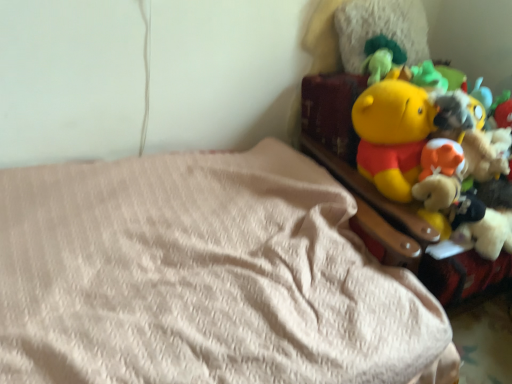
Question: From a real-world perspective, is yellow plush toy at upper right beneath beige fabric bed at lower left?

Choices:
 (A) yes
 (B) no

Answer: (B)

Question: Is there a large distance between yellow plush toy at upper right and beige fabric bed at lower left?

Choices:
 (A) yes
 (B) no

Answer: (B)

Question: Considering the relative sizes of yellow plush toy at upper right and beige fabric bed at lower left in the image provided, is yellow plush toy at upper right thinner than beige fabric bed at lower left?

Choices:
 (A) no
 (B) yes

Answer: (B)

Question: From a real-world perspective, is yellow plush toy at upper right located higher than beige fabric bed at lower left?

Choices:
 (A) no
 (B) yes

Answer: (B)

Question: Would you say yellow plush toy at upper right contains beige fabric bed at lower left?

Choices:
 (A) yes
 (B) no

Answer: (B)

Question: Is yellow plush toy at upper right positioned behind beige fabric bed at lower left?

Choices:
 (A) yes
 (B) no

Answer: (A)

Question: From the image's perspective, is beige fabric bed at lower left under yellow plush toy at upper right?

Choices:
 (A) no
 (B) yes

Answer: (B)

Question: Is beige fabric bed at lower left positioned behind yellow plush toy at upper right?

Choices:
 (A) yes
 (B) no

Answer: (B)

Question: Is beige fabric bed at lower left looking in the opposite direction of yellow plush toy at upper right?

Choices:
 (A) no
 (B) yes

Answer: (A)

Question: Considering the relative sizes of beige fabric bed at lower left and yellow plush toy at upper right in the image provided, is beige fabric bed at lower left smaller than yellow plush toy at upper right?

Choices:
 (A) yes
 (B) no

Answer: (B)

Question: Does beige fabric bed at lower left have a lesser width compared to yellow plush toy at upper right?

Choices:
 (A) yes
 (B) no

Answer: (B)

Question: Would you consider beige fabric bed at lower left to be distant from yellow plush toy at upper right?

Choices:
 (A) no
 (B) yes

Answer: (A)

Question: In terms of size, does yellow plush toy at upper right appear bigger or smaller than beige fabric bed at lower left?

Choices:
 (A) big
 (B) small

Answer: (B)